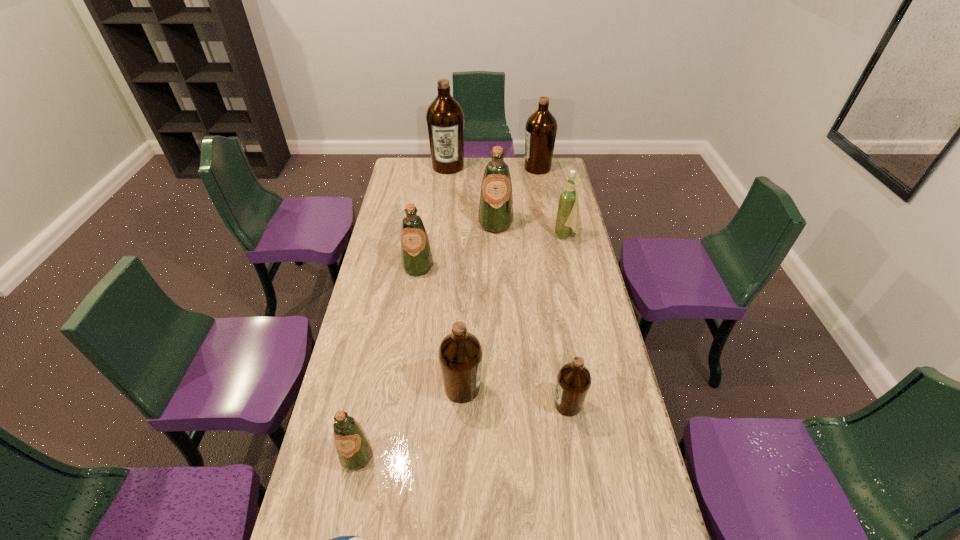
Locate an element on the screen. vacant space that satisfies the following two spatial constraints: 1. on the front-facing side of the farthest green olive oil; 2. on the label of the third biggest brown olive oil is located at coordinates (502, 388).